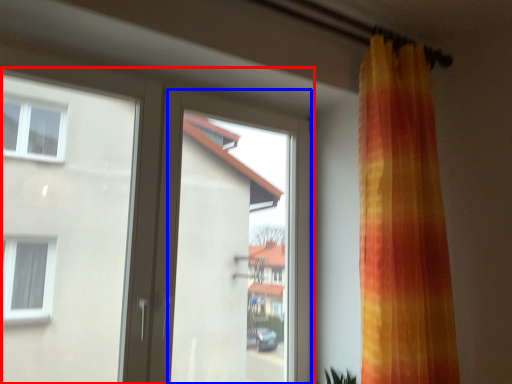
Question: Among these objects, which one is farthest to the camera, door (highlighted by a red box) or window screen (highlighted by a blue box)?

Choices:
 (A) door
 (B) window screen

Answer: (B)